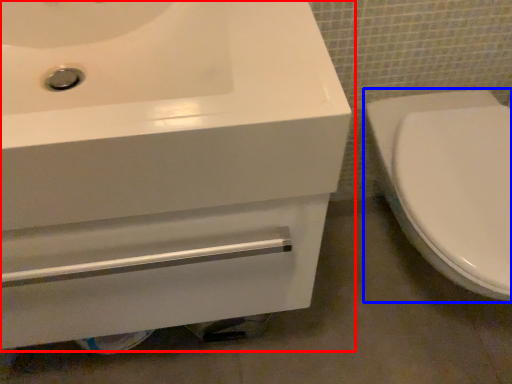
Question: Which object is closer to the camera taking this photo, sink (highlighted by a red box) or toilet (highlighted by a blue box)?

Choices:
 (A) sink
 (B) toilet

Answer: (A)